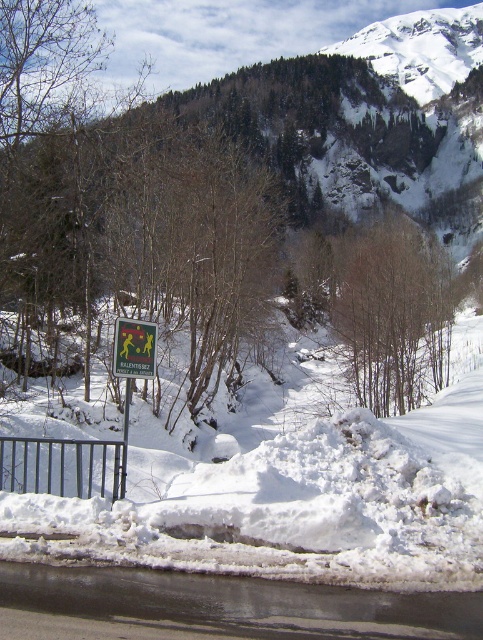
How distant is white snow ski slope at center from green plastic sign at lower left?

white snow ski slope at center is 12.66 meters away from green plastic sign at lower left.

Looking at this image, is white snow ski slope at center positioned at the back of green plastic sign at lower left?

No, white snow ski slope at center is closer to the viewer.

Does point (326, 428) come behind point (144, 364)?

Yes, it is behind point (144, 364).

Find the location of `white snow ski slope at center`. white snow ski slope at center is located at coordinates (296, 492).

Is white snow ski slope at center above green plastic sign at left?

Incorrect, white snow ski slope at center is not positioned above green plastic sign at left.

Who is positioned more to the left, white snow ski slope at center or green plastic sign at left?

From the viewer's perspective, green plastic sign at left appears more on the left side.

Is point (170, 500) farther from viewer compared to point (121, 333)?

No, it is not.

Where is `white snow ski slope at center`? The width and height of the screenshot is (483, 640). white snow ski slope at center is located at coordinates (296, 492).

Is green plastic sign at lower left to the right of green plastic sign at left from the viewer's perspective?

Correct, you'll find green plastic sign at lower left to the right of green plastic sign at left.

Between point (142, 339) and point (142, 321), which one is positioned in front?

Point (142, 321) is in front.

Which is in front, point (126, 371) or point (147, 371)?

Point (126, 371) is more forward.

Find the location of a particular element. The height and width of the screenshot is (640, 483). green plastic sign at lower left is located at coordinates (131, 369).